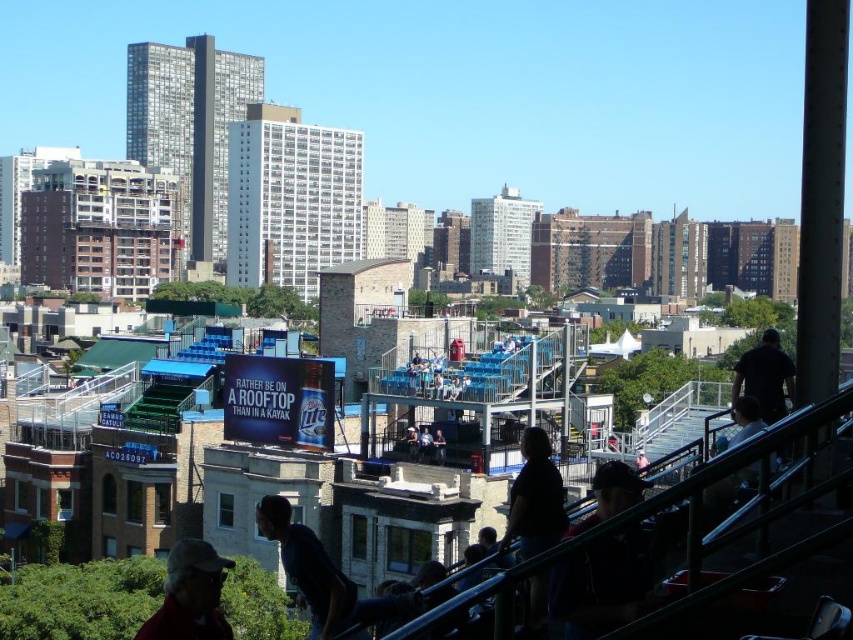
You are a photographer trying to capture both the dark blue shirt at center and the black matte shirt at upper right in the same frame. Given their sizes, which shirt would you need to position closer to the camera to ensure both fit in the shot?

The dark blue shirt at center is narrower than the black matte shirt at upper right. To include both in the frame, position the dark blue shirt at center closer to the camera since its smaller width requires less space compared to the wider black matte shirt at upper right.